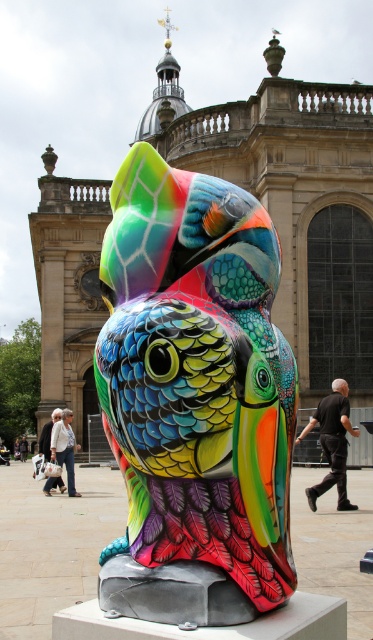
Question: Is multicolored painted bird at center above dark gray pants at lower left?

Choices:
 (A) no
 (B) yes

Answer: (B)

Question: Among these points, which one is farthest from the camera?

Choices:
 (A) (54, 413)
 (B) (311, 508)

Answer: (A)

Question: Which of these objects is positioned closest to the white cotton jacket at lower left?

Choices:
 (A) multicolored painted bird at center
 (B) dark gray pants at lower left
 (C) white cotton shirt at lower left
 (D) black cotton shirt at center

Answer: (C)

Question: Can you confirm if black cotton shirt at center is positioned to the right of white cotton jacket at lower left?

Choices:
 (A) yes
 (B) no

Answer: (A)

Question: Estimate the real-world distances between objects in this image. Which object is farther from the multicolored painted bird at center?

Choices:
 (A) white cotton jacket at lower left
 (B) dark gray pants at lower left
 (C) white cotton shirt at lower left
 (D) black cotton shirt at center

Answer: (B)

Question: Is multicolored painted bird at center to the right of white cotton shirt at lower left from the viewer's perspective?

Choices:
 (A) yes
 (B) no

Answer: (A)